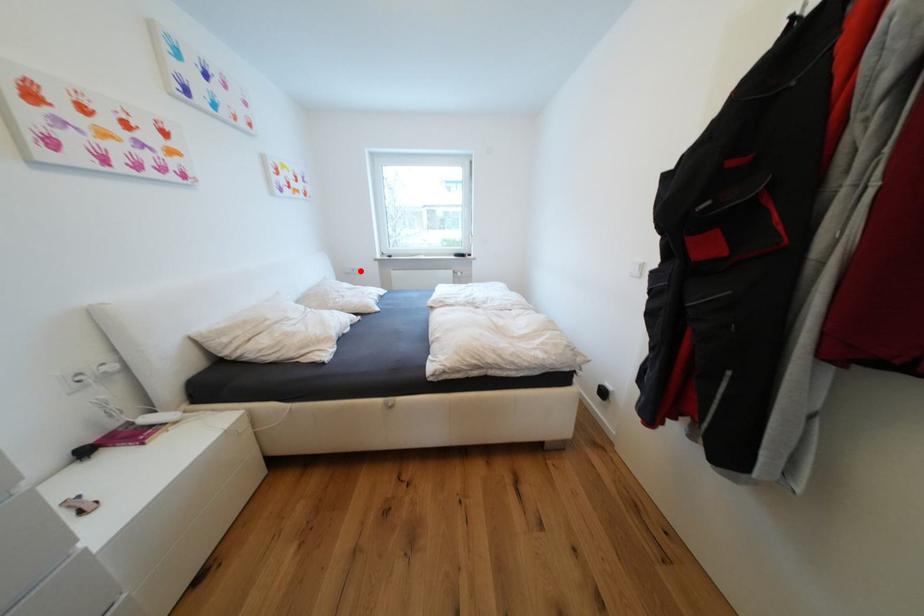
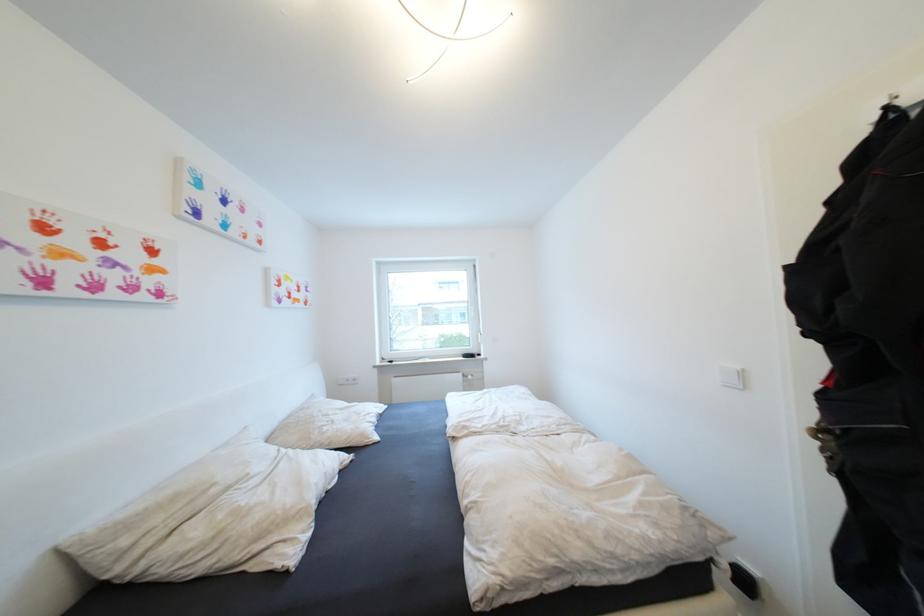
Find the pixel in the second image that matches the highlighted location in the first image.

(355, 381)